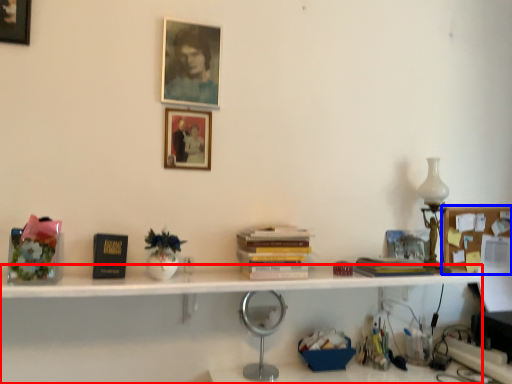
Question: Which object appears farthest to the camera in this image, bookshelf (highlighted by a red box) or shelf (highlighted by a blue box)?

Choices:
 (A) bookshelf
 (B) shelf

Answer: (B)